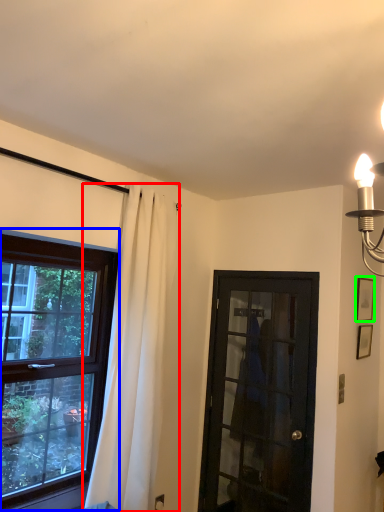
Question: Based on their relative distances, which object is farther from curtain (highlighted by a red box)? Choose from window (highlighted by a blue box) and picture frame (highlighted by a green box).

Choices:
 (A) window
 (B) picture frame

Answer: (B)